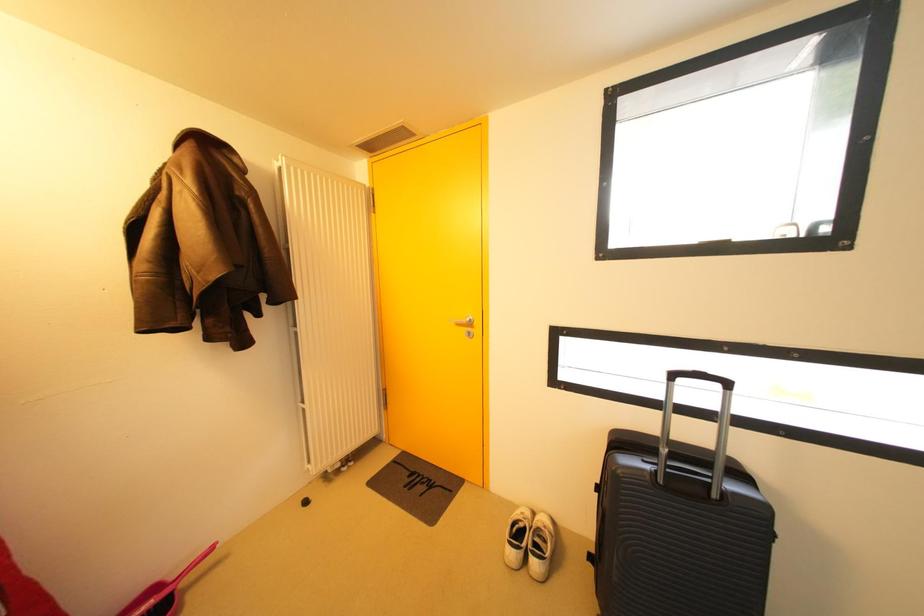
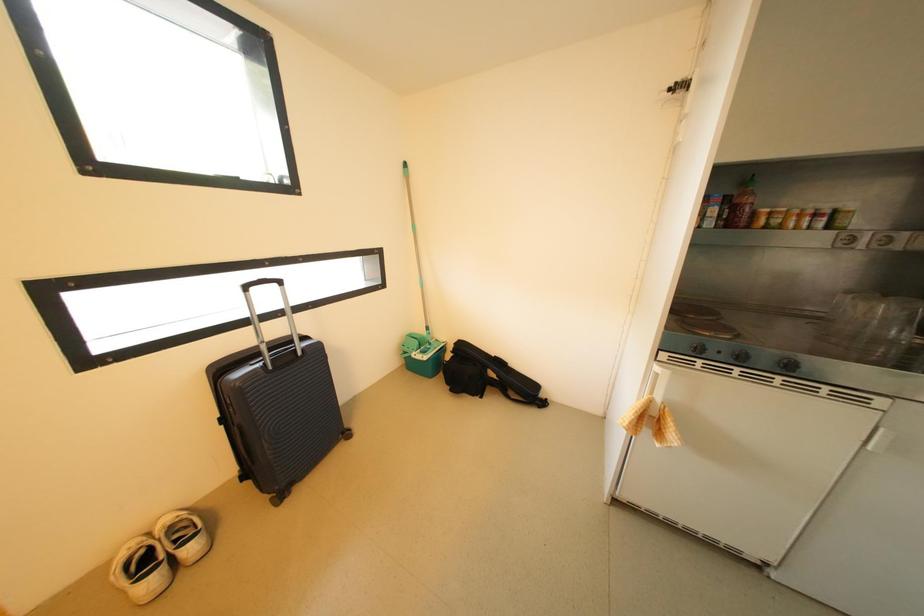
The images are taken continuously from a first-person perspective. In which direction is your viewpoint rotating?

The rotation direction of the camera is right-down.